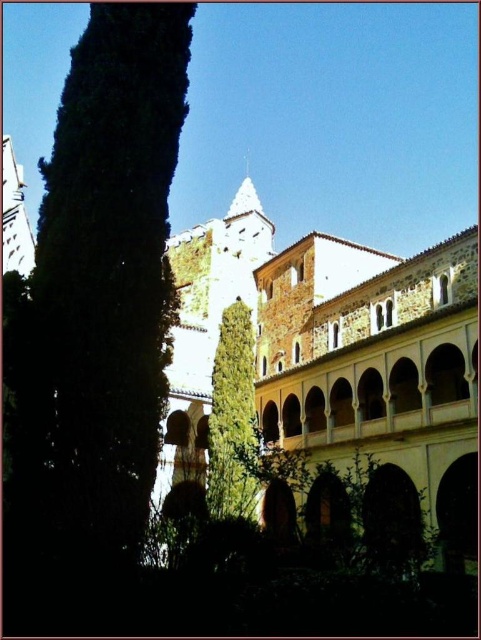
Question: Does green leafy tree at left appear under green leafy tree at center?

Choices:
 (A) no
 (B) yes

Answer: (A)

Question: Which point is closer to the camera taking this photo?

Choices:
 (A) (38, 289)
 (B) (226, 493)

Answer: (A)

Question: In this image, where is green leafy tree at left located relative to green leafy tree at center?

Choices:
 (A) left
 (B) right

Answer: (A)

Question: Is green leafy tree at left smaller than green leafy tree at center?

Choices:
 (A) no
 (B) yes

Answer: (A)